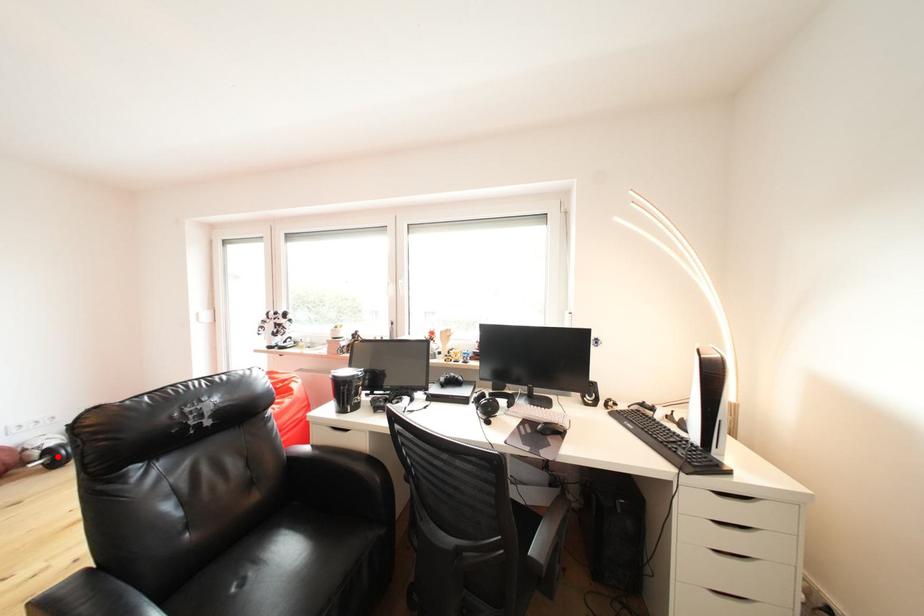
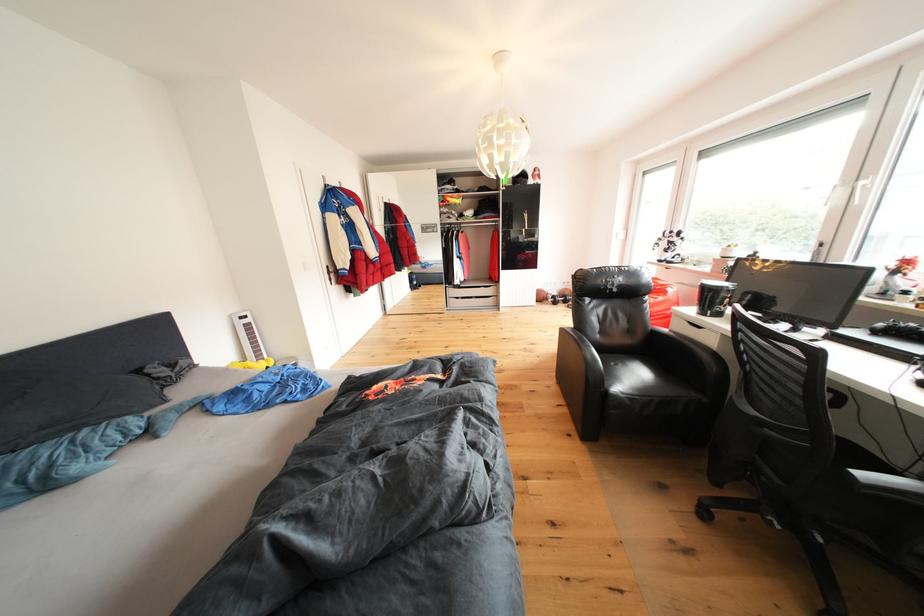
Locate, in the second image, the point that corresponds to the highlighted location in the first image.

(563, 302)